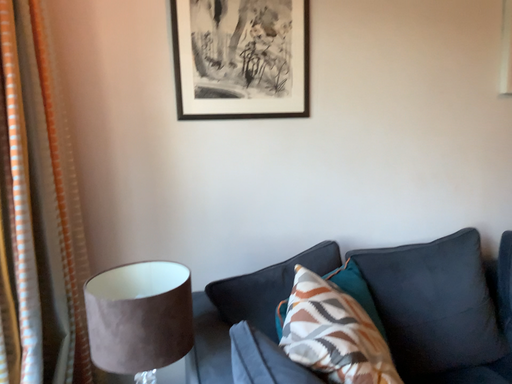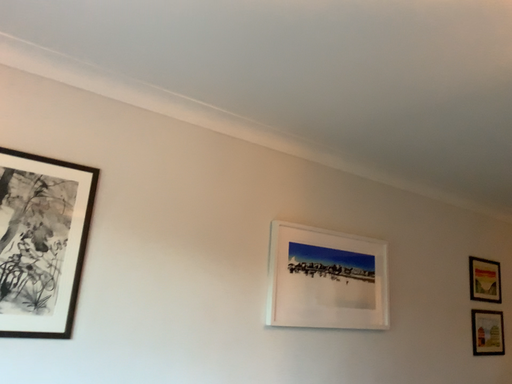
Question: How did the camera likely rotate when shooting the video?

Choices:
 (A) rotated downward
 (B) rotated upward

Answer: (B)